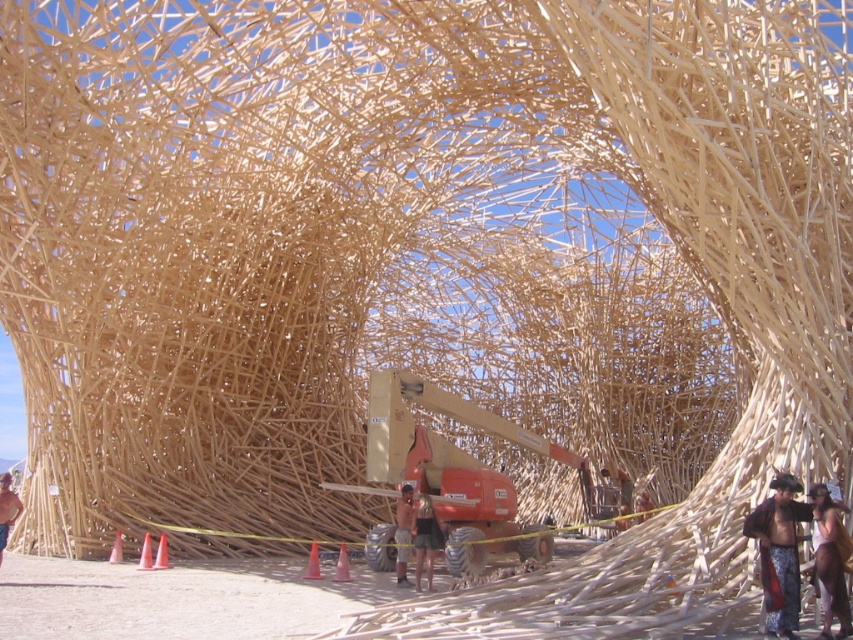
You are a visitor walking through the structure and see the black fabric shorts at center and the pink plastic cone at lower center. Which object is closer to you as you enter the structure?

The black fabric shorts at center is closer to you because the pink plastic cone at lower center is behind it.

You are standing in front of the wooden structure and notice two points marked on the framework. The first point is at coordinate (311, 545) and the second at (144, 536). Which point is closer to your eyes?

Point (144, 536) is closer to your eyes because it is positioned closer to the camera compared to point (311, 545), which is further away.